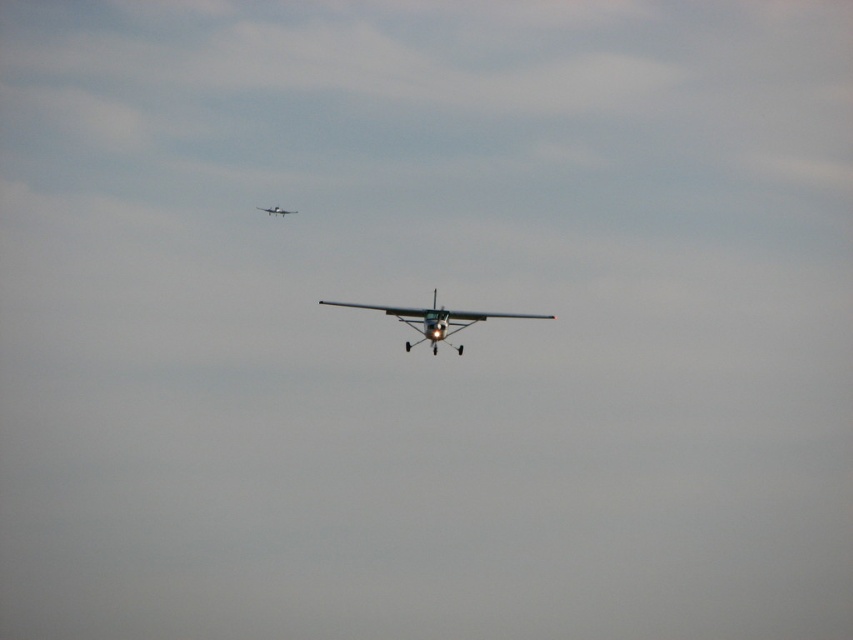
Question: Among these objects, which one is nearest to the camera?

Choices:
 (A) metallic silver airplane at center
 (B) metallic silver airplane at upper center

Answer: (A)

Question: Does metallic silver airplane at center appear over metallic silver airplane at upper center?

Choices:
 (A) no
 (B) yes

Answer: (A)

Question: Is metallic silver airplane at center in front of metallic silver airplane at upper center?

Choices:
 (A) no
 (B) yes

Answer: (B)

Question: Can you confirm if metallic silver airplane at center is positioned to the left of metallic silver airplane at upper center?

Choices:
 (A) no
 (B) yes

Answer: (A)